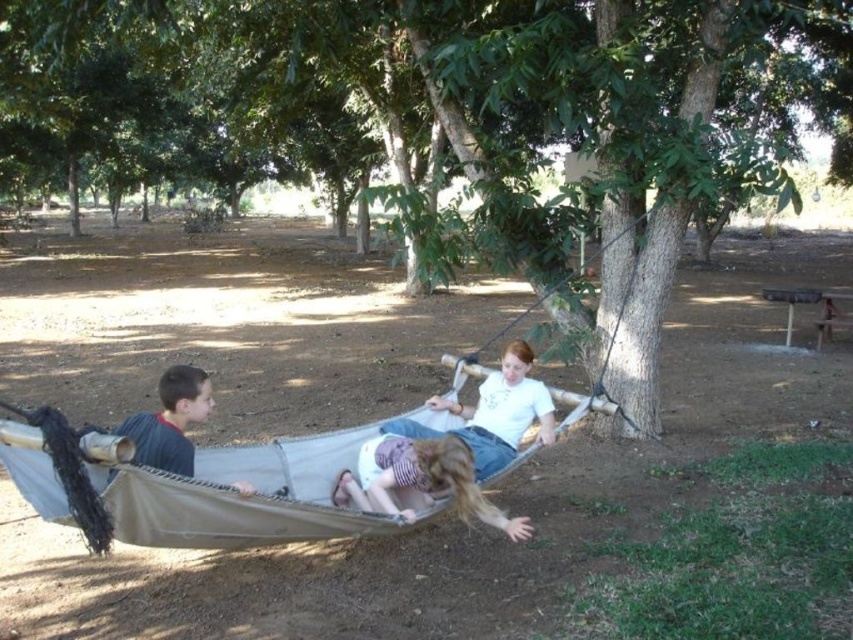
Question: Which object appears closest to the camera in this image?

Choices:
 (A) green leafy tree at center
 (B) gray fabric hammock at left
 (C) beige canvas hammock at center
 (D) light purple fabric hammock at center

Answer: (C)

Question: Which of these objects is positioned closest to the beige canvas hammock at center?

Choices:
 (A) light purple fabric hammock at center
 (B) gray fabric hammock at left

Answer: (A)

Question: Which is nearer to the green leafy tree at center?

Choices:
 (A) gray fabric hammock at left
 (B) beige canvas hammock at center
 (C) light purple fabric hammock at center

Answer: (C)

Question: Is green leafy tree at center positioned in front of beige canvas hammock at center?

Choices:
 (A) no
 (B) yes

Answer: (A)

Question: Observing the image, what is the correct spatial positioning of beige canvas hammock at center in reference to light purple fabric hammock at center?

Choices:
 (A) below
 (B) above

Answer: (B)

Question: Can you confirm if light purple fabric hammock at center is positioned to the right of gray fabric hammock at left?

Choices:
 (A) no
 (B) yes

Answer: (B)